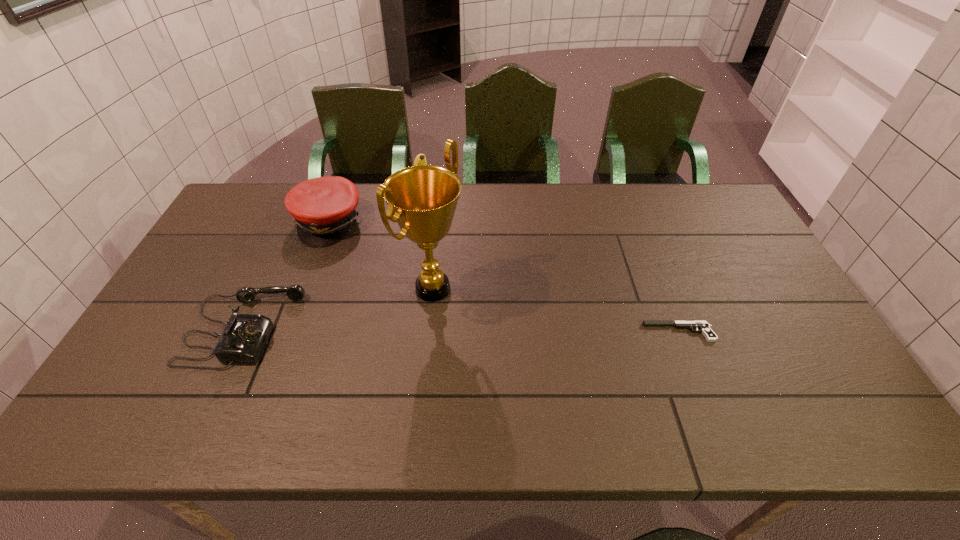
At what (x,y) coordinates should I click in order to perform the action: click on cap that is positioned at the far edge. Please return your answer as a coordinate pair (x, y). Looking at the image, I should click on (324, 209).

Locate an element on the screen. This screenshot has height=540, width=960. object positioned at the near edge is located at coordinates (244, 337).

Identify the location of object that is at the left edge. (244, 337).

Where is `object at the near left corner`? Image resolution: width=960 pixels, height=540 pixels. object at the near left corner is located at coordinates (244, 337).

I want to click on free region at the far edge, so click(x=582, y=214).

Where is `free location at the near edge of the desktop`? free location at the near edge of the desktop is located at coordinates (603, 381).

In the image, there is a desktop. Where is `vacant space at the left edge`? vacant space at the left edge is located at coordinates (233, 294).

Locate an element on the screen. Image resolution: width=960 pixels, height=540 pixels. blank area at the right edge is located at coordinates (759, 355).

The width and height of the screenshot is (960, 540). I want to click on vacant area at the far left corner of the desktop, so click(278, 190).

Locate an element on the screen. free location at the near left corner is located at coordinates (127, 391).